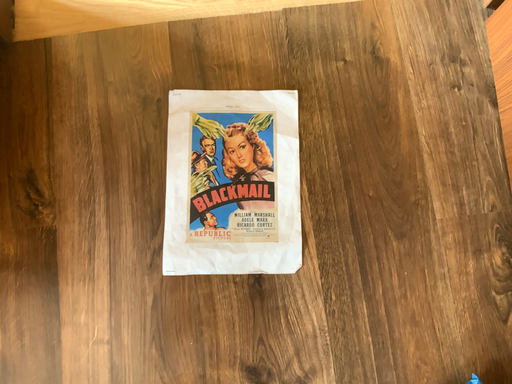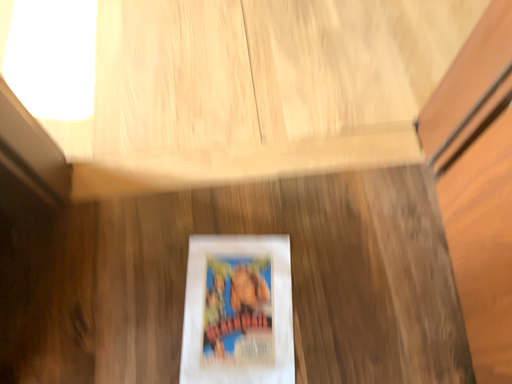
Question: Which way did the camera rotate in the video?

Choices:
 (A) rotated downward
 (B) rotated upward

Answer: (B)